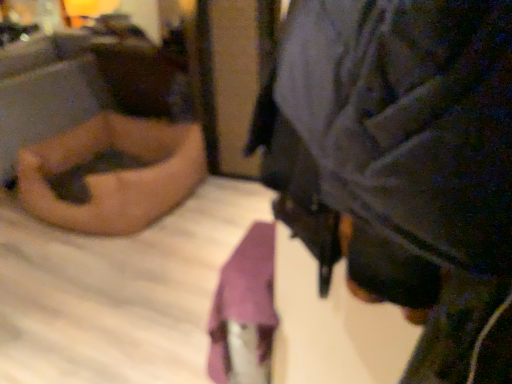
Image resolution: width=512 pixels, height=384 pixels. In order to click on velvet-like black jacket at center, which appears as the second person when viewed from the back in this screenshot , I will do `click(400, 161)`.

The height and width of the screenshot is (384, 512). What do you see at coordinates (400, 161) in the screenshot? I see `velvet-like black jacket at center, acting as the 1th person starting from the front` at bounding box center [400, 161].

What do you see at coordinates (114, 174) in the screenshot? The image size is (512, 384). I see `matte black laptop at left, the 1th person when ordered from left to right` at bounding box center [114, 174].

Locate an element on the screen. matte black laptop at left, the second person positioned from the right is located at coordinates (114, 174).

Where is `velvet-like black jacket at center, which is the 1th person in right-to-left order`? The image size is (512, 384). velvet-like black jacket at center, which is the 1th person in right-to-left order is located at coordinates (400, 161).

Between matte black laptop at left, the second person positioned from the right, and velvet-like black jacket at center, which is the 1th person in right-to-left order, which one appears on the right side from the viewer's perspective?

velvet-like black jacket at center, which is the 1th person in right-to-left order, is more to the right.

Between matte black laptop at left, the 1th person when ordered from left to right, and velvet-like black jacket at center, placed as the 2th person when sorted from left to right, which one is positioned in front?

Positioned in front is velvet-like black jacket at center, placed as the 2th person when sorted from left to right.

Is point (183, 157) positioned after point (366, 216)?

That is True.

From the image's perspective, is matte black laptop at left, positioned as the 1th person in back-to-front order, above or below velvet-like black jacket at center, which appears as the second person when viewed from the back?

Based on their image positions, matte black laptop at left, positioned as the 1th person in back-to-front order, is located above velvet-like black jacket at center, which appears as the second person when viewed from the back.

From a real-world perspective, is matte black laptop at left, marked as the second person in a front-to-back arrangement, above or below velvet-like black jacket at center, which is the 1th person in right-to-left order?

In terms of real-world spatial position, matte black laptop at left, marked as the second person in a front-to-back arrangement, is below velvet-like black jacket at center, which is the 1th person in right-to-left order.

Considering the sizes of matte black laptop at left, the second person positioned from the right, and velvet-like black jacket at center, acting as the 1th person starting from the front, in the image, is matte black laptop at left, the second person positioned from the right, wider or thinner than velvet-like black jacket at center, acting as the 1th person starting from the front,?

Considering their sizes, matte black laptop at left, the second person positioned from the right, looks broader than velvet-like black jacket at center, acting as the 1th person starting from the front.

Is matte black laptop at left, marked as the second person in a front-to-back arrangement, taller than velvet-like black jacket at center, which is the 1th person in right-to-left order?

Yes, matte black laptop at left, marked as the second person in a front-to-back arrangement, is taller than velvet-like black jacket at center, which is the 1th person in right-to-left order.

Considering the relative sizes of matte black laptop at left, positioned as the 1th person in back-to-front order, and velvet-like black jacket at center, which is the 1th person in right-to-left order, in the image provided, is matte black laptop at left, positioned as the 1th person in back-to-front order, smaller than velvet-like black jacket at center, which is the 1th person in right-to-left order,?

No, matte black laptop at left, positioned as the 1th person in back-to-front order, is not smaller than velvet-like black jacket at center, which is the 1th person in right-to-left order.

Is velvet-like black jacket at center, which is the 1th person in right-to-left order, a part of matte black laptop at left, marked as the second person in a front-to-back arrangement?

No, velvet-like black jacket at center, which is the 1th person in right-to-left order, is located outside of matte black laptop at left, marked as the second person in a front-to-back arrangement.

Would you consider matte black laptop at left, the second person positioned from the right, to be distant from velvet-like black jacket at center, acting as the 1th person starting from the front?

Absolutely, matte black laptop at left, the second person positioned from the right, is distant from velvet-like black jacket at center, acting as the 1th person starting from the front.

Is matte black laptop at left, the second person positioned from the right, oriented away from velvet-like black jacket at center, which is the 1th person in right-to-left order?

That's right, matte black laptop at left, the second person positioned from the right, is facing away from velvet-like black jacket at center, which is the 1th person in right-to-left order.

How different are the orientations of matte black laptop at left, positioned as the 1th person in back-to-front order, and velvet-like black jacket at center, placed as the 2th person when sorted from left to right, in degrees?

The angle between the facing direction of matte black laptop at left, positioned as the 1th person in back-to-front order, and the facing direction of velvet-like black jacket at center, placed as the 2th person when sorted from left to right, is 86.9 degrees.

How far apart are matte black laptop at left, the 1th person when ordered from left to right, and velvet-like black jacket at center, acting as the 1th person starting from the front?

The distance of matte black laptop at left, the 1th person when ordered from left to right, from velvet-like black jacket at center, acting as the 1th person starting from the front, is 2.02 meters.

Where is `person that is in front of the matte black laptop at left, the second person positioned from the right`? Image resolution: width=512 pixels, height=384 pixels. person that is in front of the matte black laptop at left, the second person positioned from the right is located at coordinates (400, 161).

Considering the relative positions of velvet-like black jacket at center, which is the 1th person in right-to-left order, and matte black laptop at left, the 1th person when ordered from left to right, in the image provided, is velvet-like black jacket at center, which is the 1th person in right-to-left order, to the left of matte black laptop at left, the 1th person when ordered from left to right, from the viewer's perspective?

In fact, velvet-like black jacket at center, which is the 1th person in right-to-left order, is to the right of matte black laptop at left, the 1th person when ordered from left to right.

Is the position of velvet-like black jacket at center, which appears as the second person when viewed from the back, more distant than that of matte black laptop at left, marked as the second person in a front-to-back arrangement?

No, the depth of velvet-like black jacket at center, which appears as the second person when viewed from the back, is less than that of matte black laptop at left, marked as the second person in a front-to-back arrangement.

Does point (425, 347) lie in front of point (118, 213)?

Yes, point (425, 347) is in front of point (118, 213).

From the image's perspective, does velvet-like black jacket at center, which is the 1th person in right-to-left order, appear lower than matte black laptop at left, the second person positioned from the right?

Yes, from the image's perspective, velvet-like black jacket at center, which is the 1th person in right-to-left order, is beneath matte black laptop at left, the second person positioned from the right.

From a real-world perspective, is velvet-like black jacket at center, acting as the 1th person starting from the front, below matte black laptop at left, positioned as the 1th person in back-to-front order?

No, from a real-world perspective, velvet-like black jacket at center, acting as the 1th person starting from the front, is not beneath matte black laptop at left, positioned as the 1th person in back-to-front order.

Is velvet-like black jacket at center, which appears as the second person when viewed from the back, thinner than matte black laptop at left, the 1th person when ordered from left to right?

Correct, the width of velvet-like black jacket at center, which appears as the second person when viewed from the back, is less than that of matte black laptop at left, the 1th person when ordered from left to right.

Considering the sizes of objects velvet-like black jacket at center, which appears as the second person when viewed from the back, and matte black laptop at left, marked as the second person in a front-to-back arrangement, in the image provided, who is shorter, velvet-like black jacket at center, which appears as the second person when viewed from the back, or matte black laptop at left, marked as the second person in a front-to-back arrangement,?

velvet-like black jacket at center, which appears as the second person when viewed from the back.

Who is bigger, velvet-like black jacket at center, which appears as the second person when viewed from the back, or matte black laptop at left, the 1th person when ordered from left to right?

With larger size is matte black laptop at left, the 1th person when ordered from left to right.

Do you think velvet-like black jacket at center, which appears as the second person when viewed from the back, is within matte black laptop at left, the second person positioned from the right, or outside of it?

velvet-like black jacket at center, which appears as the second person when viewed from the back, exists outside the volume of matte black laptop at left, the second person positioned from the right.

Is velvet-like black jacket at center, acting as the 1th person starting from the front, next to matte black laptop at left, marked as the second person in a front-to-back arrangement, and touching it?

No, velvet-like black jacket at center, acting as the 1th person starting from the front, is not with matte black laptop at left, marked as the second person in a front-to-back arrangement.

Is matte black laptop at left, positioned as the 1th person in back-to-front order, at the back of velvet-like black jacket at center, which is the 1th person in right-to-left order?

No, velvet-like black jacket at center, which is the 1th person in right-to-left order, is not facing the opposite direction of matte black laptop at left, positioned as the 1th person in back-to-front order.

Measure the distance between velvet-like black jacket at center, which is the 1th person in right-to-left order, and matte black laptop at left, the 1th person when ordered from left to right.

2.02 meters.

What are the coordinates of `person that is above the velvet-like black jacket at center, which appears as the second person when viewed from the back (from the image's perspective)` in the screenshot? It's located at (114, 174).

Where is `person below the velvet-like black jacket at center, which is the 1th person in right-to-left order (from a real-world perspective)`? person below the velvet-like black jacket at center, which is the 1th person in right-to-left order (from a real-world perspective) is located at coordinates (114, 174).

Locate an element on the screen. person to the left of velvet-like black jacket at center, acting as the 1th person starting from the front is located at coordinates (114, 174).